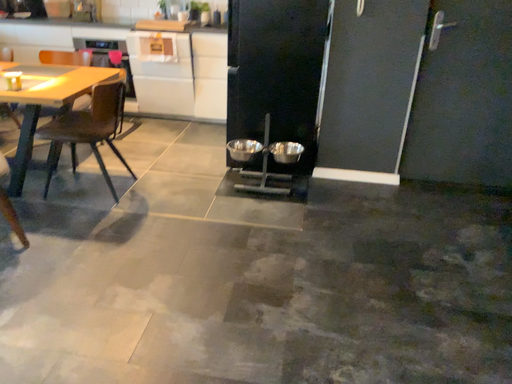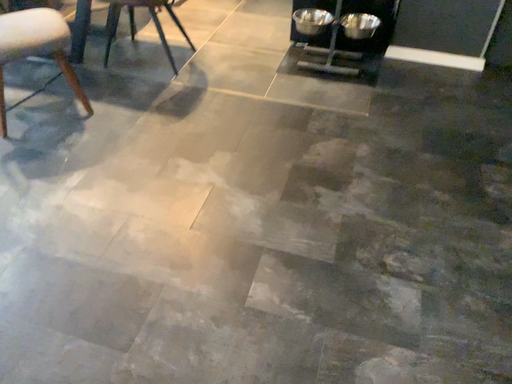
Question: Which way did the camera rotate in the video?

Choices:
 (A) rotated left
 (B) rotated right

Answer: (A)